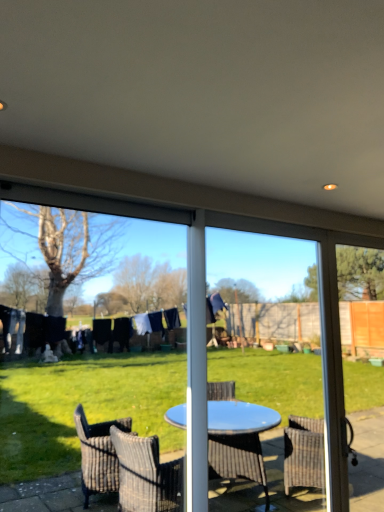
Question: From a real-world perspective, relative to blue plastic table at center, the 2th screen door in the right-to-left sequence, is transparent glass screen door at right, which appears as the 1th screen door when viewed from the right, vertically above or below?

Choices:
 (A) below
 (B) above

Answer: (A)

Question: Is point (331, 253) closer or farther from the camera than point (264, 306)?

Choices:
 (A) closer
 (B) farther

Answer: (A)

Question: Which is nearer to the transparent plastic screen at center?

Choices:
 (A) transparent glass screen door at right, which appears as the 1th screen door when viewed from the right
 (B) blue plastic table at center, positioned as the 1th screen door in left-to-right order

Answer: (B)

Question: Considering the real-world distances, which object is closest to the transparent plastic screen at center?

Choices:
 (A) blue plastic table at center, the 2th screen door in the right-to-left sequence
 (B) transparent glass screen door at right, the second screen door when ordered from left to right

Answer: (A)